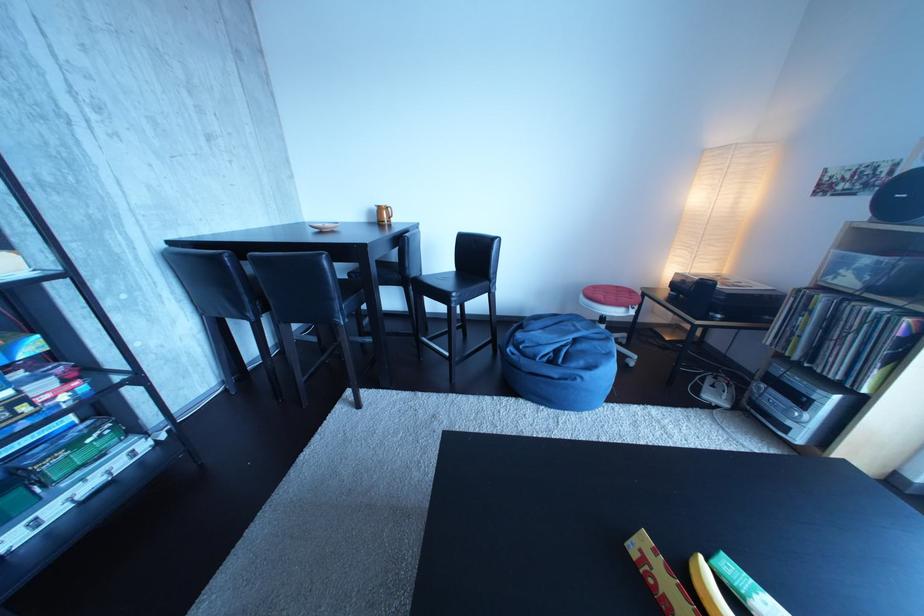
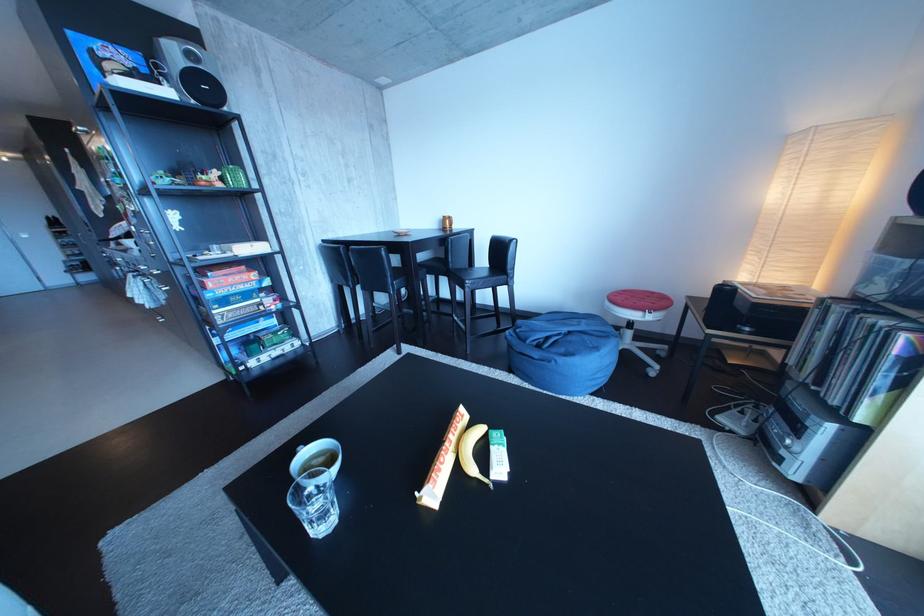
Question: Based on the continuous images, in which direction is the camera rotating? Reply with the corresponding letter.

Choices:
 (A) Left
 (B) Right
 (C) Up
 (D) Down

Answer: (A)